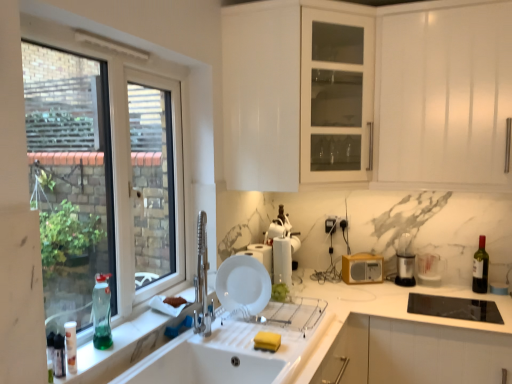
I want to click on free area in between white plastic bottle at lower left, the 1th bottle from the left, and green glass bottle at window, which ranks as the second bottle in front-to-back order, so click(x=84, y=356).